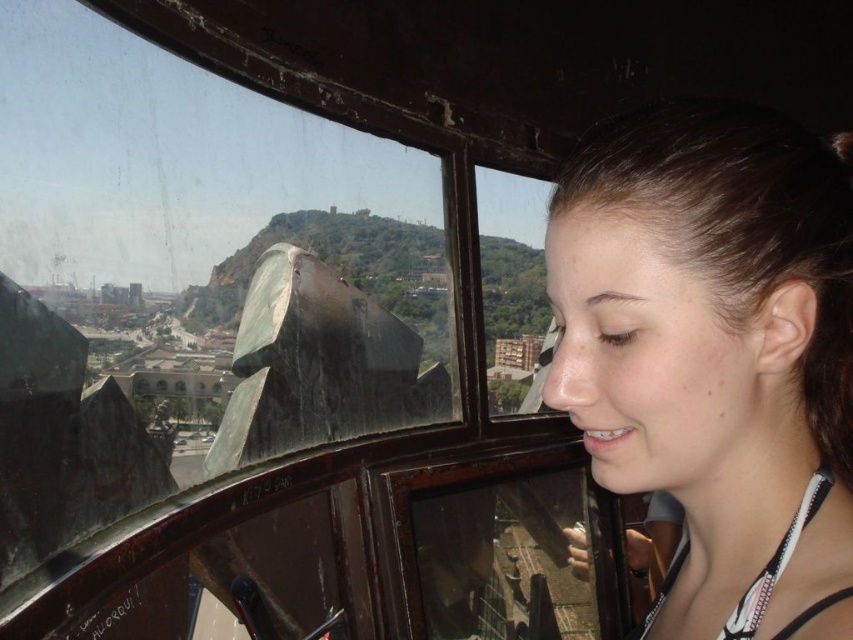
You are a passenger sitting in the cable car and want to observe the view outside. Which object, the transparent glass window at center or the smooth brown hair at right, is closer to your eyes?

The transparent glass window at center is closer to your eyes because it is further to the viewer than the smooth brown hair at right.

You are a passenger in the cable car and want to check your reflection in the transparent glass window at center while your smooth brown hair at right is moving. Considering the width of both objects, which one is wider?

The transparent glass window at center is wider than the smooth brown hair at right because its width surpasses the hair.